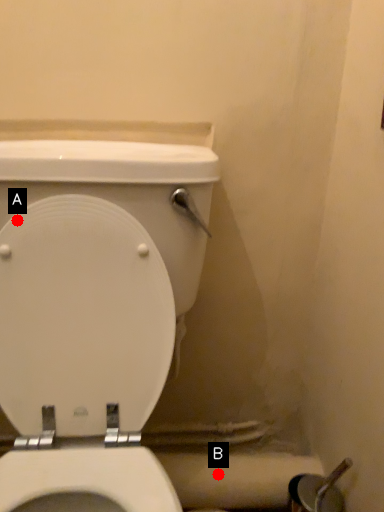
Question: Two points are circled on the image, labeled by A and B beside each circle. Which point is further to the camera?

Choices:
 (A) A is further
 (B) B is further

Answer: (B)